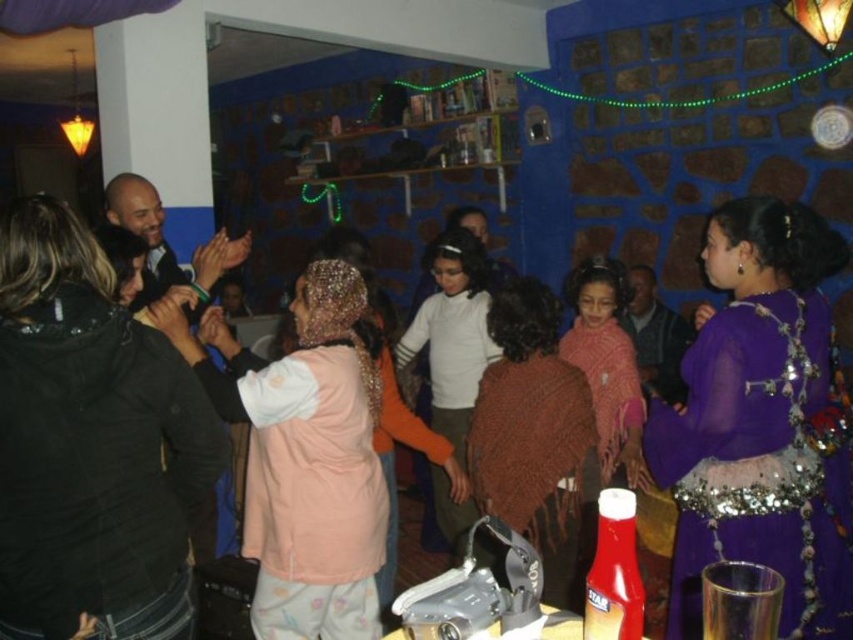
Can you confirm if black leather jacket at left is bigger than white matte sweater at center?

Actually, black leather jacket at left might be smaller than white matte sweater at center.

Is point (148, 460) closer to viewer compared to point (486, 328)?

Yes, point (148, 460) is closer to viewer.

Find the location of a particular element. black leather jacket at left is located at coordinates click(91, 444).

Does point (711, 321) lie behind point (491, 356)?

No, it is in front of (491, 356).

Who is higher up, purple sequined dress at center or white matte sweater at center?

white matte sweater at center

This screenshot has width=853, height=640. In order to click on purple sequined dress at center in this screenshot , I will do `click(761, 422)`.

The image size is (853, 640). I want to click on purple sequined dress at center, so click(x=761, y=422).

Can you confirm if purple sequined dress at center is positioned below pale pink fleece at center?

No, purple sequined dress at center is not below pale pink fleece at center.

Is point (769, 452) farther from camera compared to point (358, 404)?

No, (769, 452) is in front of (358, 404).

Identify the location of purple sequined dress at center. The image size is (853, 640). (761, 422).